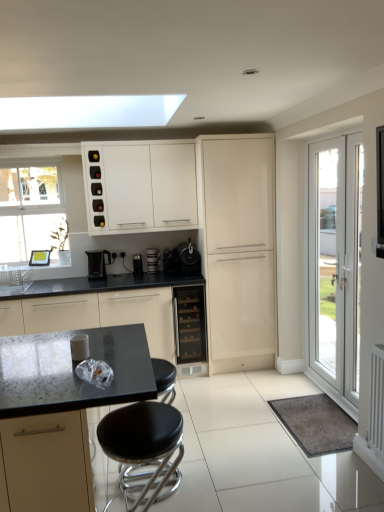
Identify the location of vacant space to the right of black plastic kettle at center. The height and width of the screenshot is (512, 384). (125, 275).